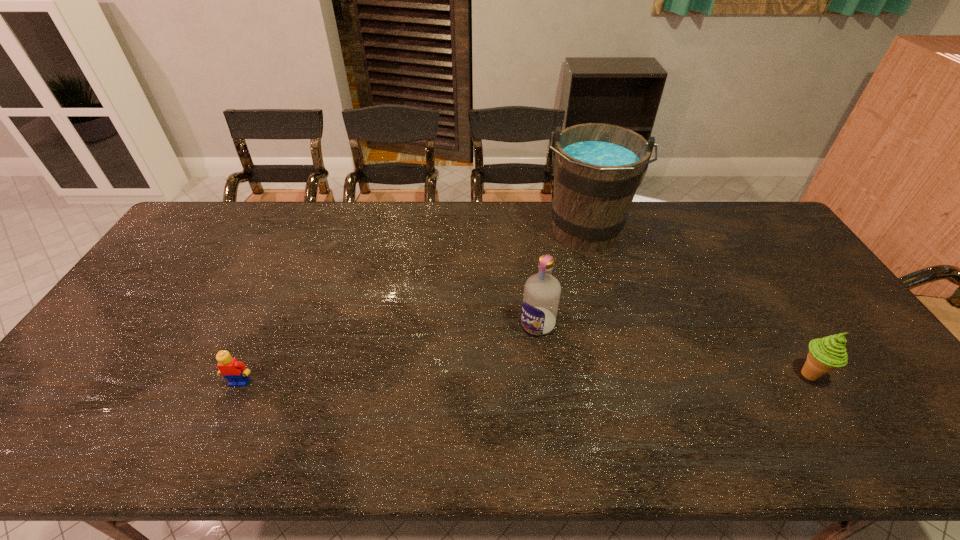
You are a GUI agent. You are given a task and a screenshot of the screen. Output one action in this format:
    pyautogui.click(x=<x>, y=<y>)
    Task: Click on the blank space located with a handle on the side of the farthest object
    Image resolution: width=960 pixels, height=540 pixels.
    Given the screenshot: What is the action you would take?
    pyautogui.click(x=570, y=342)

Find the location of a particular element. vacant space located with a handle on the side of the farthest object is located at coordinates (571, 337).

Find the location of a particular element. The image size is (960, 540). blank area located 0.090m on the label of the second tallest object is located at coordinates (510, 357).

Locate an element on the screen. Image resolution: width=960 pixels, height=540 pixels. vacant space located 0.170m on the label of the second tallest object is located at coordinates (492, 378).

Locate an element on the screen. free space located 0.160m on the label of the second tallest object is located at coordinates (494, 375).

Find the location of `object that is at the far edge`. object that is at the far edge is located at coordinates (597, 168).

Where is `Lego located at the near edge`? The image size is (960, 540). Lego located at the near edge is located at coordinates (235, 371).

Where is `icecream that is at the near edge`? The height and width of the screenshot is (540, 960). icecream that is at the near edge is located at coordinates (825, 354).

Where is `object that is at the right edge`? This screenshot has width=960, height=540. object that is at the right edge is located at coordinates (825, 354).

What are the coordinates of `object at the near right corner` in the screenshot? It's located at (825, 354).